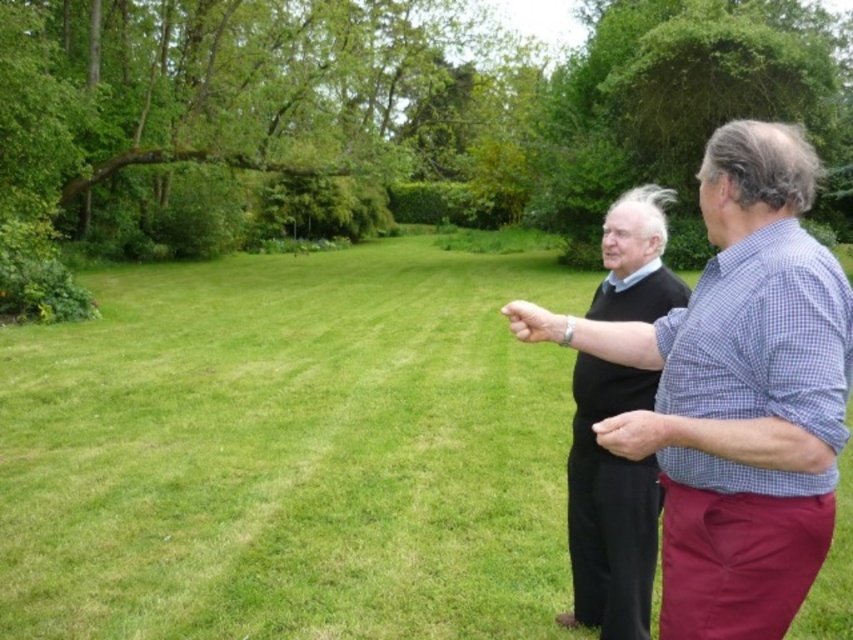
Question: Which point appears farthest from the camera in this image?

Choices:
 (A) (729, 166)
 (B) (648, 634)
 (C) (554, 515)

Answer: (C)

Question: Does checkered fabric shirt at right appear on the left side of black sweater at center?

Choices:
 (A) yes
 (B) no

Answer: (A)

Question: Which point is closer to the camera taking this photo?

Choices:
 (A) (606, 230)
 (B) (782, 192)
 (C) (167, 317)

Answer: (B)

Question: Does checkered fabric shirt at right have a smaller size compared to black sweater at center?

Choices:
 (A) yes
 (B) no

Answer: (B)

Question: Can you confirm if green grass at center is thinner than checkered fabric shirt at right?

Choices:
 (A) yes
 (B) no

Answer: (B)

Question: Which of the following is the closest to the observer?

Choices:
 (A) green grass at center
 (B) checkered fabric shirt at right

Answer: (B)